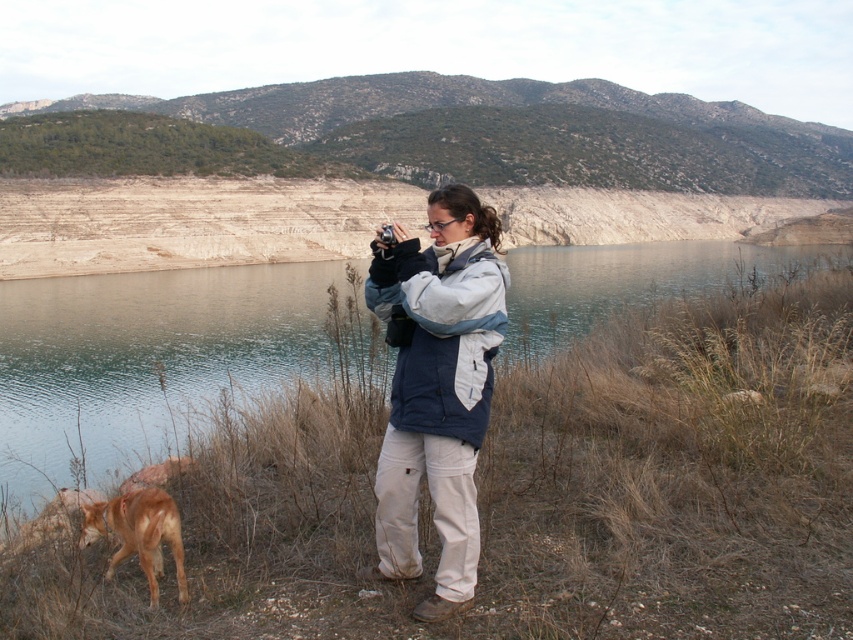
Is clear water at center above brown fur dog at lower left?

Yes.

Does clear water at center appear on the right side of brown fur dog at lower left?

Yes, clear water at center is to the right of brown fur dog at lower left.

Measure the distance between point (90, 296) and camera.

58.44 meters

In order to click on clear water at center in this screenshot , I will do `click(143, 362)`.